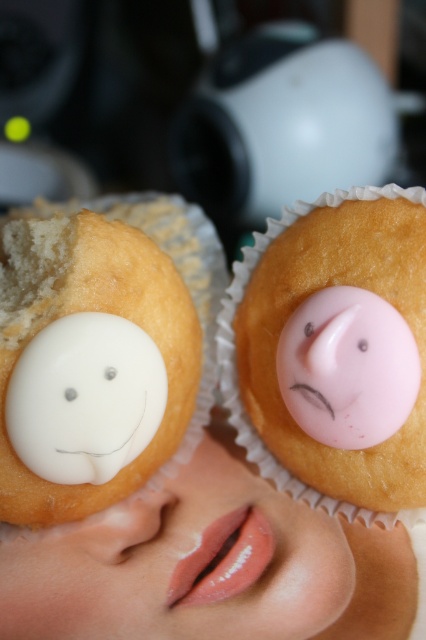
Does white glossy muffin at left appear on the left side of pink matte/soft eye at center?

Correct, you'll find white glossy muffin at left to the left of pink matte/soft eye at center.

Is point (339, 301) farther from camera compared to point (308, 326)?

That is False.

At what (x,y) coordinates should I click in order to perform the action: click on white glossy muffin at left. Please return your answer as a coordinate pair (x, y). The width and height of the screenshot is (426, 640). Looking at the image, I should click on (230, 436).

Who is higher up, white glossy frosting at center or white matte/soft eye at center?

white matte/soft eye at center

The image size is (426, 640). I want to click on white glossy frosting at center, so pos(181,563).

Image resolution: width=426 pixels, height=640 pixels. I want to click on white glossy frosting at center, so click(x=181, y=563).

I want to click on white glossy frosting at center, so click(x=181, y=563).

What do you see at coordinates (181, 563) in the screenshot?
I see `white glossy frosting at center` at bounding box center [181, 563].

Is white glossy frosting at center smaller than pink matte/soft eye at center?

Actually, white glossy frosting at center might be larger than pink matte/soft eye at center.

Does point (103, 531) come farther from viewer compared to point (307, 337)?

Yes.

Where is `white glossy frosting at center`? Image resolution: width=426 pixels, height=640 pixels. white glossy frosting at center is located at coordinates (181, 563).